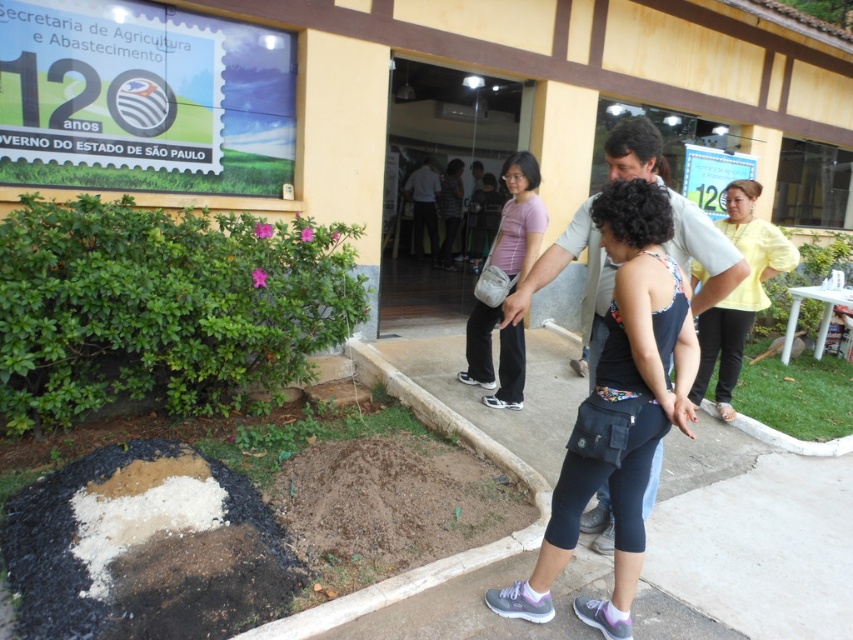
Question: Which point is closer to the camera taking this photo?

Choices:
 (A) (846, 605)
 (B) (728, 380)
 (C) (490, 380)

Answer: (A)

Question: Which object is the farthest from the purple fabric bag at center?

Choices:
 (A) gray concrete pavement at center
 (B) yellow matte shirt at right

Answer: (B)

Question: Considering the relative positions of dark blue fabric tank top at center and purple fabric bag at center in the image provided, where is dark blue fabric tank top at center located with respect to purple fabric bag at center?

Choices:
 (A) left
 (B) right

Answer: (B)

Question: In this image, where is gray concrete pavement at center located relative to purple fabric bag at center?

Choices:
 (A) above
 (B) below

Answer: (B)

Question: Can you confirm if gray concrete pavement at center is bigger than dark blue fabric tank top at center?

Choices:
 (A) yes
 (B) no

Answer: (A)

Question: Which point is farther to the camera?

Choices:
 (A) (782, 609)
 (B) (515, 278)
 (C) (749, 225)

Answer: (C)